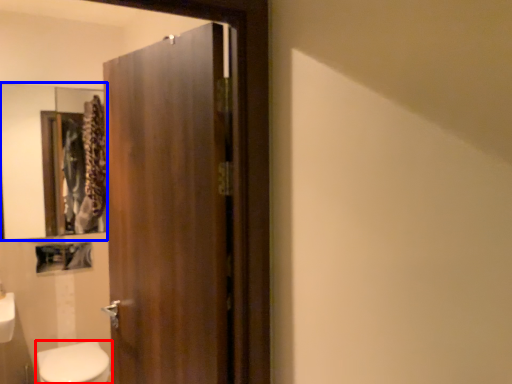
Question: Which object is closer to the camera taking this photo, bidet (highlighted by a red box) or mirror (highlighted by a blue box)?

Choices:
 (A) bidet
 (B) mirror

Answer: (A)